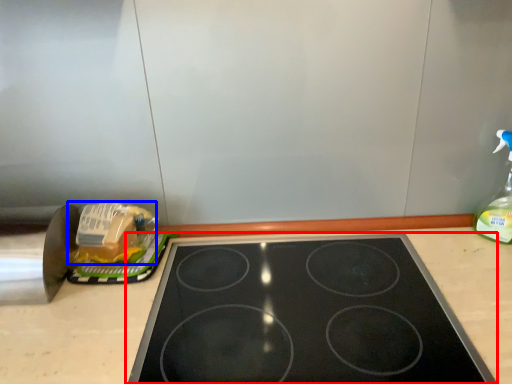
Question: Which point is further to the camera, gas stove (highlighted by a red box) or food (highlighted by a blue box)?

Choices:
 (A) gas stove
 (B) food

Answer: (B)